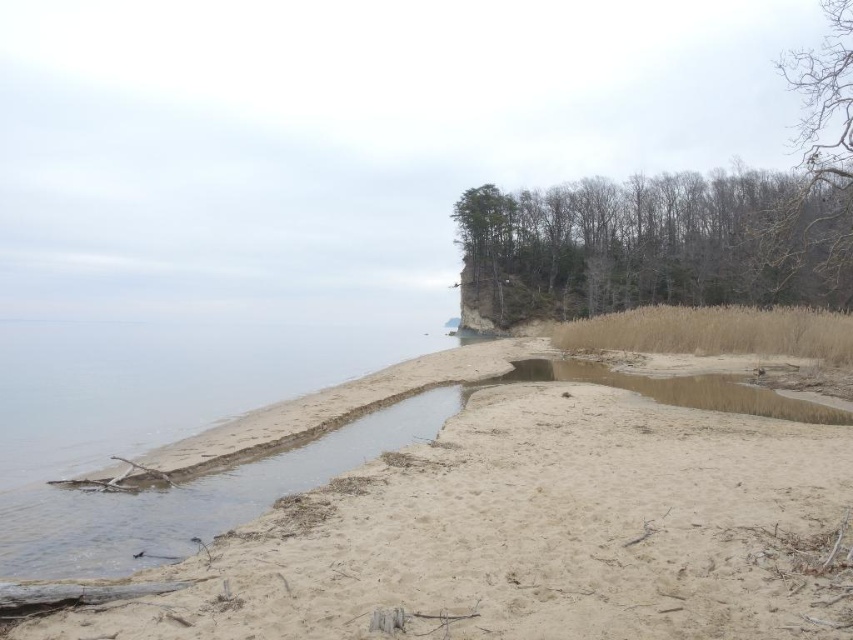
You are standing on the sandy beach and looking towards the water. You notice two elements at the upper right corner of your view. Which of the two, the bare wood trees at upper right or the bare branches at upper right, is positioned lower in your field of view?

The bare wood trees at upper right is positioned lower than the bare branches at upper right in the upper right corner of the view.